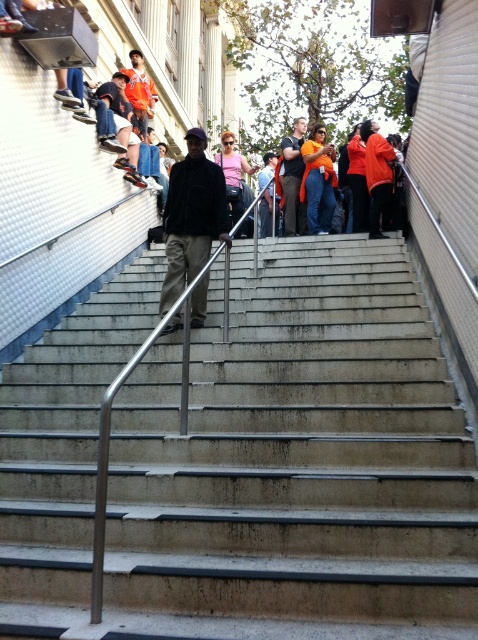
Does dark brown leather jacket at center appear on the right side of orange fabric shirt at upper center?

No, dark brown leather jacket at center is not to the right of orange fabric shirt at upper center.

Does dark brown leather jacket at center have a larger size compared to orange fabric shirt at upper center?

Indeed, dark brown leather jacket at center has a larger size compared to orange fabric shirt at upper center.

Between point (170, 280) and point (322, 182), which one is positioned in front?

Positioned in front is point (170, 280).

Image resolution: width=478 pixels, height=640 pixels. I want to click on dark brown leather jacket at center, so click(x=192, y=216).

Who is taller, concrete stairs at center or orange fabric shirt at upper center?

With more height is orange fabric shirt at upper center.

Describe the element at coordinates (295, 464) in the screenshot. I see `concrete stairs at center` at that location.

Locate an element on the screen. The width and height of the screenshot is (478, 640). concrete stairs at center is located at coordinates (295, 464).

Can you confirm if concrete stairs at center is positioned to the left of orange shirt at center?

Indeed, concrete stairs at center is positioned on the left side of orange shirt at center.

Does point (460, 520) come closer to viewer compared to point (297, 145)?

That is True.

Image resolution: width=478 pixels, height=640 pixels. In order to click on concrete stairs at center in this screenshot , I will do `click(295, 464)`.